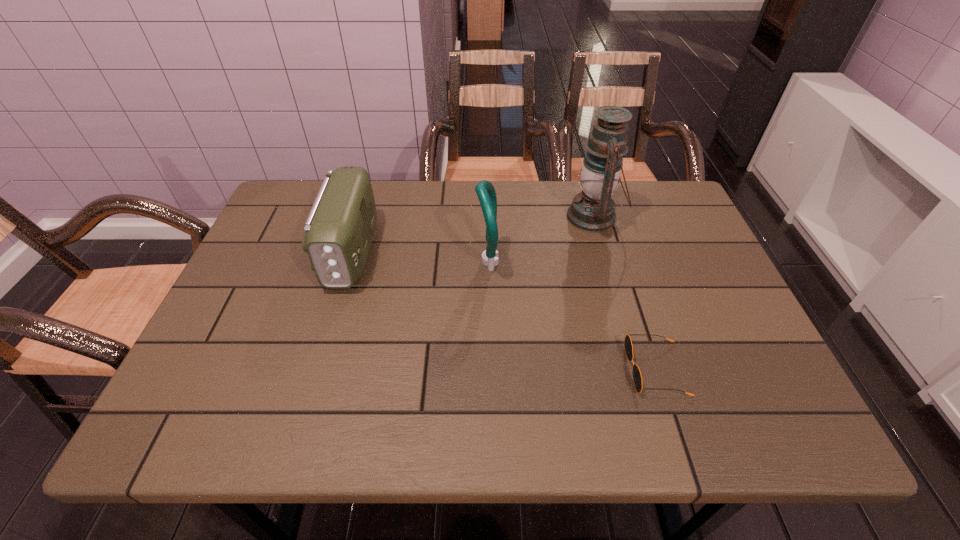
I want to click on vacant space at the left edge of the desktop, so click(x=218, y=323).

Identify the location of free region at the right edge of the desktop. (687, 256).

At what (x,y) coordinates should I click in order to perform the action: click on free space at the far left corner. Please return your answer as a coordinate pair (x, y). The height and width of the screenshot is (540, 960). Looking at the image, I should click on (299, 188).

Identify the location of free space at the far right corner of the desktop. The image size is (960, 540). (648, 206).

Where is `free space between the leftmost object and the nearest object`? Image resolution: width=960 pixels, height=540 pixels. free space between the leftmost object and the nearest object is located at coordinates (503, 310).

At what (x,y) coordinates should I click in order to perform the action: click on vacant area between the oil lamp and the leftmost object. Please return your answer as a coordinate pair (x, y). Image resolution: width=960 pixels, height=540 pixels. Looking at the image, I should click on (472, 234).

Locate an element on the screen. unoccupied area between the nearest object and the second shortest object is located at coordinates (503, 310).

The height and width of the screenshot is (540, 960). What are the coordinates of `vacant space that's between the third object from right to left and the tallest object` in the screenshot? It's located at (540, 239).

At what (x,y) coordinates should I click in order to perform the action: click on free space between the oil lamp and the third shortest object. Please return your answer as a coordinate pair (x, y). Looking at the image, I should click on (540, 239).

Locate an element on the screen. This screenshot has height=540, width=960. free point between the radio_receiver and the oil lamp is located at coordinates (472, 234).